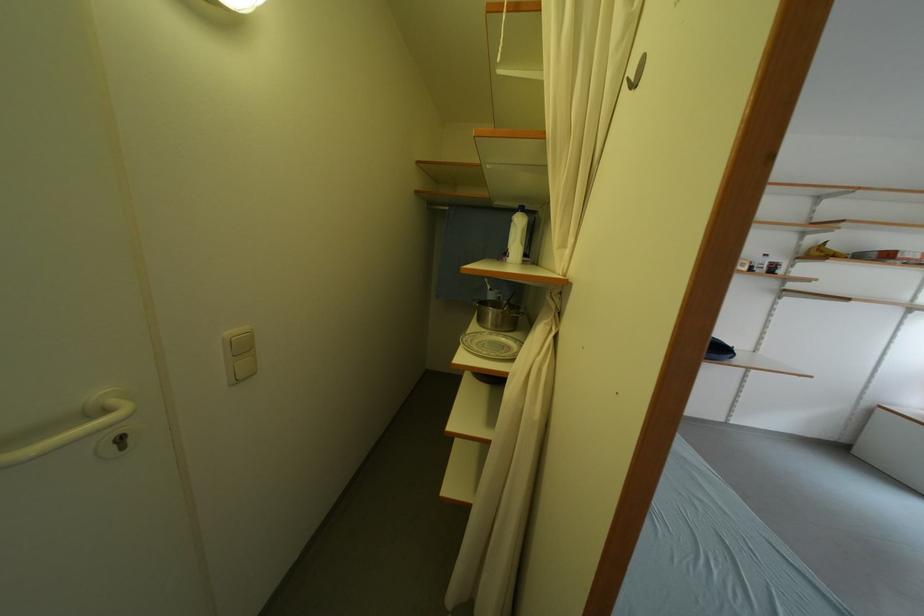
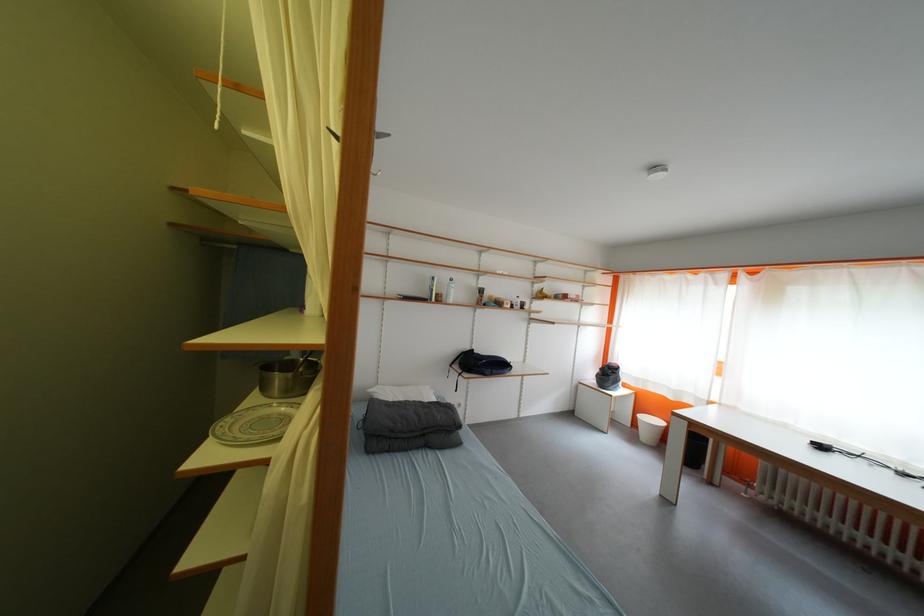
Question: How did the camera likely rotate?

Choices:
 (A) Left
 (B) Right
 (C) Up
 (D) Down

Answer: (B)